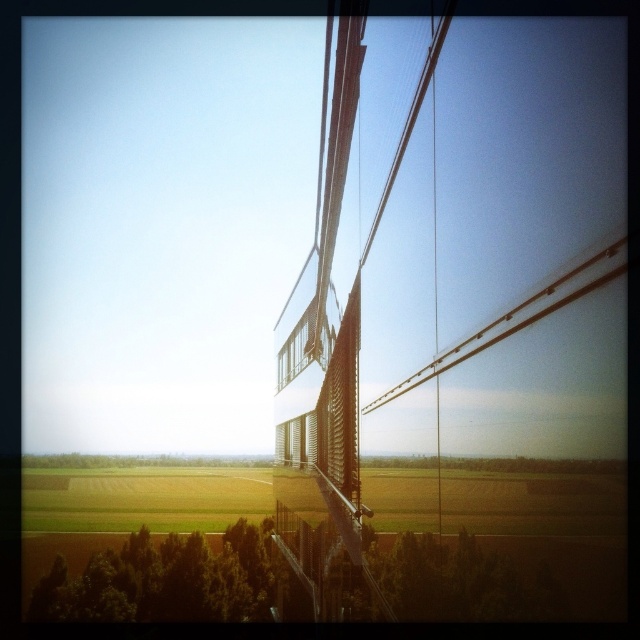
Question: Is green leafy tree at lower left to the right of clear glass window at center from the viewer's perspective?

Choices:
 (A) no
 (B) yes

Answer: (A)

Question: Which point is closer to the camera taking this photo?

Choices:
 (A) (x=61, y=564)
 (B) (x=310, y=332)

Answer: (B)

Question: From the image, what is the correct spatial relationship of green leafy tree at lower left in relation to clear glass window at center?

Choices:
 (A) below
 (B) above

Answer: (A)

Question: Is green leafy tree at lower left behind clear glass window at center?

Choices:
 (A) yes
 (B) no

Answer: (A)

Question: Among these objects, which one is farthest from the camera?

Choices:
 (A) green leafy tree at lower left
 (B) clear glass window at center

Answer: (A)